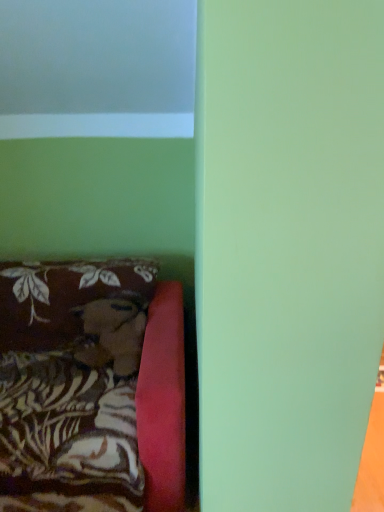
Question: Should I look upward or downward to see brown fabric cushion at lower left?

Choices:
 (A) down
 (B) up

Answer: (A)